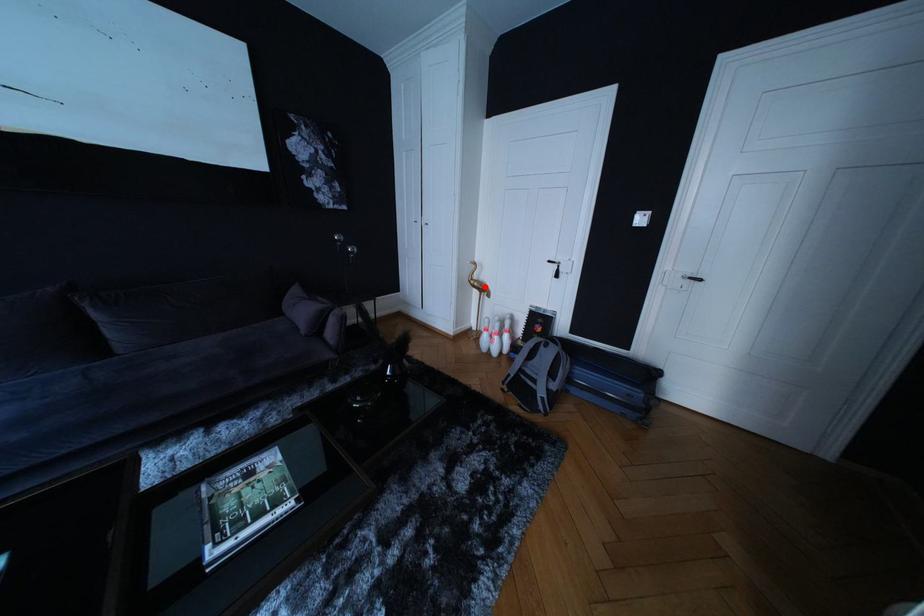
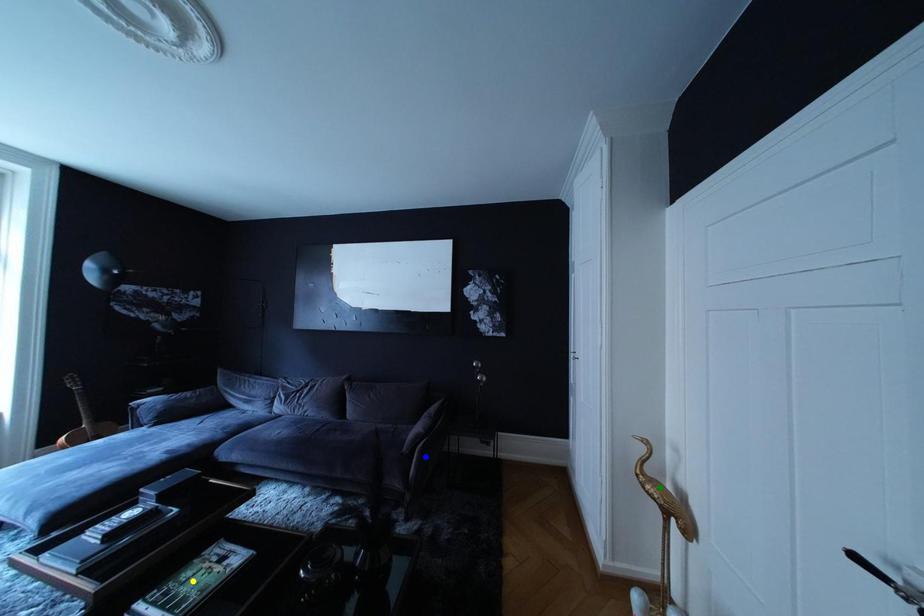
Question: I am providing you with two images of the same scene from different viewpoints. A red point is marked on the first image. You are given multiple points on the second image. Which point in image 2 represents the same 3d spot as the red point in image 1?

Choices:
 (A) blue point
 (B) yellow point
 (C) green point

Answer: (C)